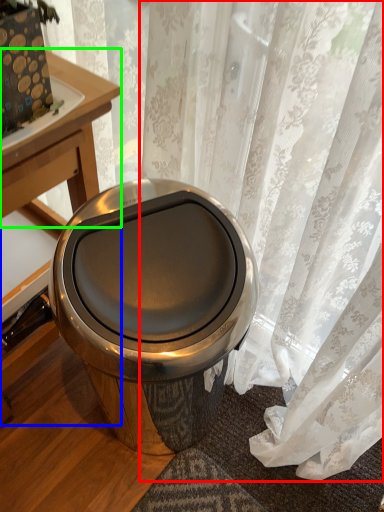
Question: Considering the real-world distances, which object is closest to curtain (highlighted by a red box)? table (highlighted by a blue box) or round table (highlighted by a green box).

Choices:
 (A) table
 (B) round table

Answer: (B)